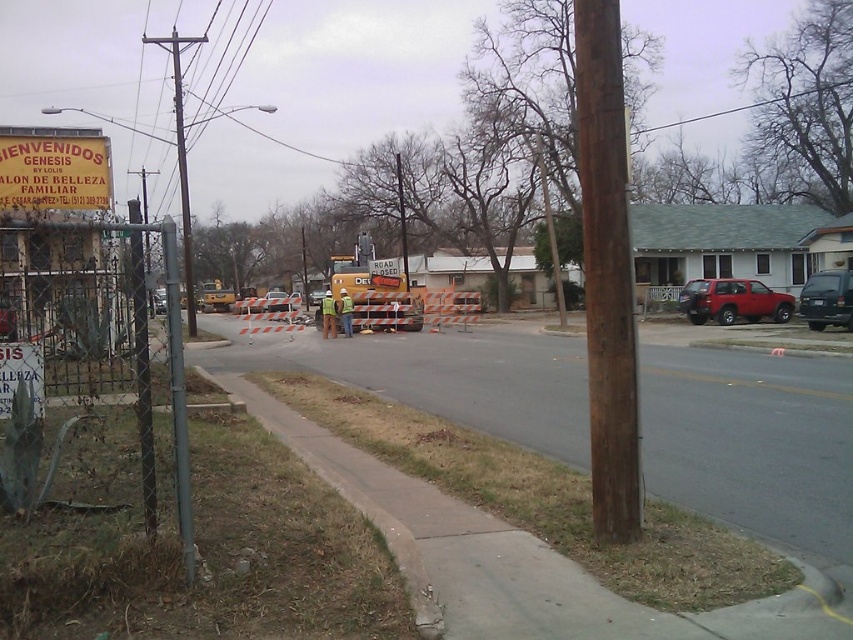
Between black wire at upper center and green reflective vest at center, which one has more height?

Standing taller between the two is black wire at upper center.

Is point (813, 90) closer to camera compared to point (340, 301)?

No, (813, 90) is behind (340, 301).

Locate an element on the screen. This screenshot has height=640, width=853. black wire at upper center is located at coordinates (750, 104).

Is matte red suv at right above green reflective safety vest at center?

Correct, matte red suv at right is located above green reflective safety vest at center.

Between point (701, 317) and point (332, 330), which one is positioned behind?

The point (332, 330) is behind.

You are a GUI agent. You are given a task and a screenshot of the screen. Output one action in this format:
    pyautogui.click(x=<x>, y=<y>)
    Task: Click on the matte red suv at right
    Image resolution: width=853 pixels, height=640 pixels.
    Given the screenshot: What is the action you would take?
    pyautogui.click(x=733, y=301)

Is brown wooden telegraph pole at left to the left of yellow construction vehicle at center from the viewer's perspective?

No, brown wooden telegraph pole at left is not to the left of yellow construction vehicle at center.

Find the location of a particular element. This screenshot has width=853, height=640. brown wooden telegraph pole at left is located at coordinates (181, 157).